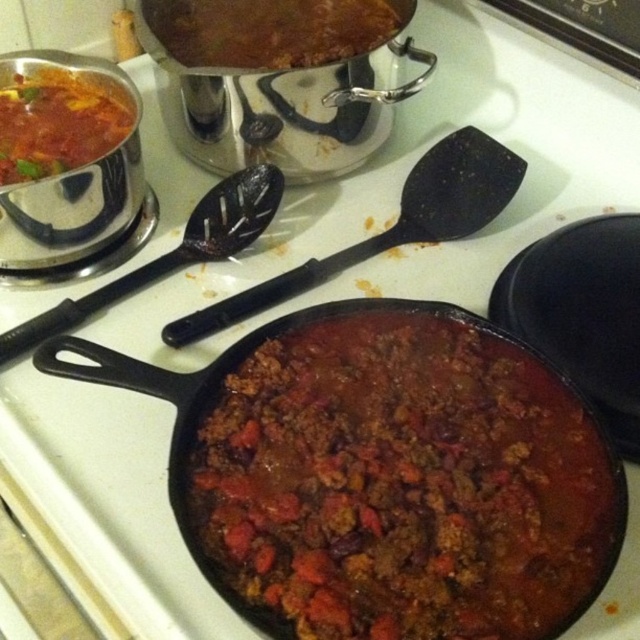
Which of these two, black plastic spatula at center or brown matte pot at upper center, stands taller?

Standing taller between the two is black plastic spatula at center.

Can you confirm if black plastic spatula at center is wider than brown matte pot at upper center?

Yes.

Identify the location of black plastic spatula at center. The width and height of the screenshot is (640, 640). (390, 227).

From the picture: Is brown matte pot at upper center closer to the viewer compared to black plastic spoon at upper left?

No, it is behind black plastic spoon at upper left.

Is brown matte pot at upper center to the right of black plastic spoon at upper left from the viewer's perspective?

Yes, brown matte pot at upper center is to the right of black plastic spoon at upper left.

The height and width of the screenshot is (640, 640). Find the location of `brown matte pot at upper center`. brown matte pot at upper center is located at coordinates (268, 29).

What do you see at coordinates (401, 483) in the screenshot? This screenshot has width=640, height=640. I see `brown matte chili at center` at bounding box center [401, 483].

Does point (509, 500) lie in front of point (433, 240)?

Yes.

At what (x,y) coordinates should I click in order to perform the action: click on brown matte chili at center. Please return your answer as a coordinate pair (x, y). The image size is (640, 640). Looking at the image, I should click on (401, 483).

Where is `brown matte chili at center`? The height and width of the screenshot is (640, 640). brown matte chili at center is located at coordinates (401, 483).